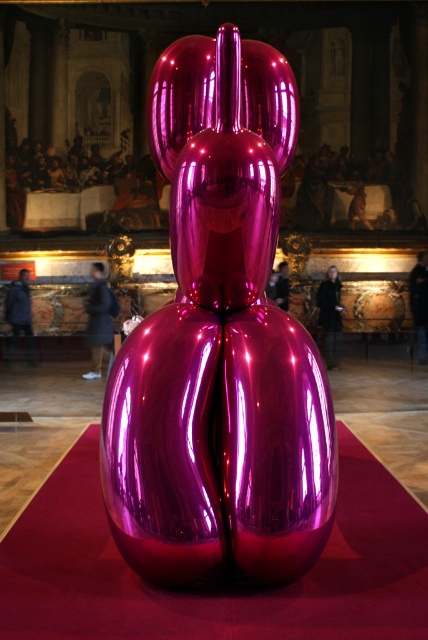
Based on the photo, you are a security guard in the gallery. You see the glossy purple mat at center and the dark brown leather jacket at center. Which object is positioned to the left?

The glossy purple mat at center is positioned to the left of the dark brown leather jacket at center.

Looking at this image, you are standing in the grand historical interior space where the metallic sculpture is displayed on a red carpet. You notice two points marked on the floor at coordinates point (8, 355) and point (424, 340). If you were to walk from the sculpture towards the entrance, which point would you step on first?

Point (8, 355) is in front of point (424, 340), so you would step on point (8, 355) first when walking from the sculpture towards the entrance.